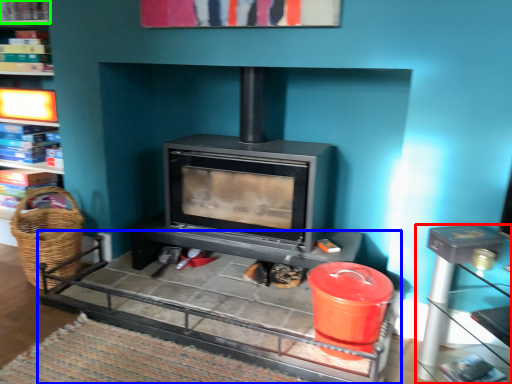
Question: Which is nearer to the table (highlighted by a red box)? table (highlighted by a blue box) or shelf (highlighted by a green box).

Choices:
 (A) table
 (B) shelf

Answer: (A)